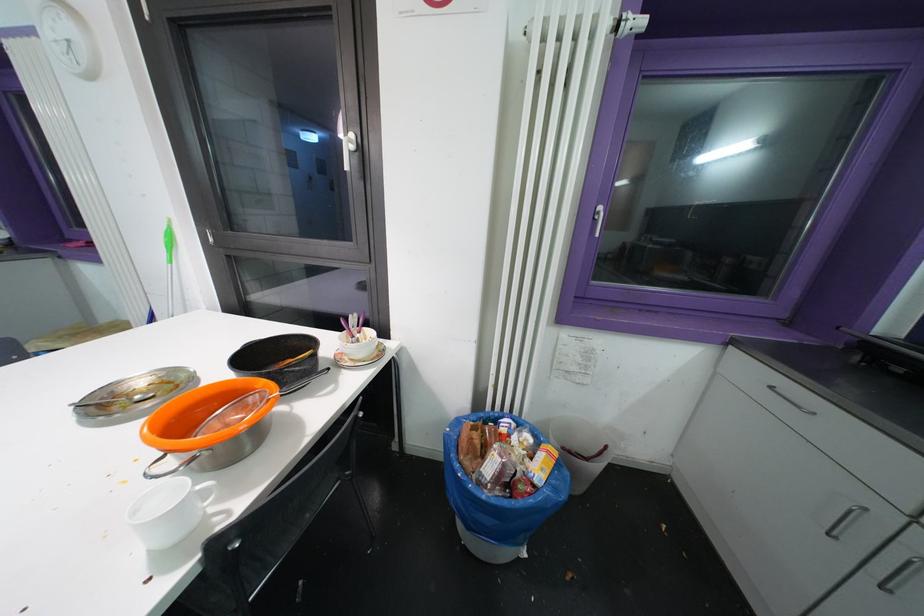
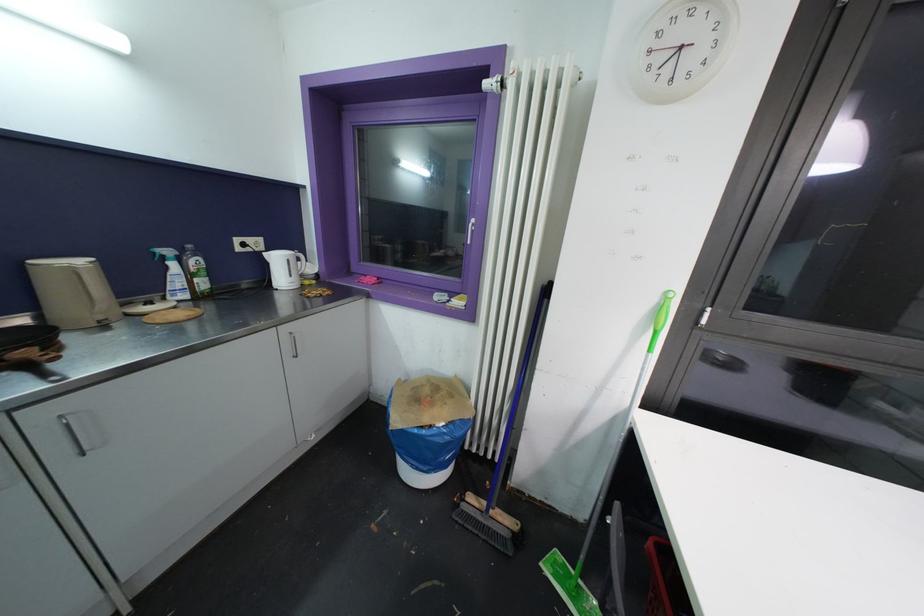
Question: Which direction would the cameraman need to move to produce the second image? Reply with the corresponding letter.

Choices:
 (A) Left
 (B) Right
 (C) Forward
 (D) Backward

Answer: (A)